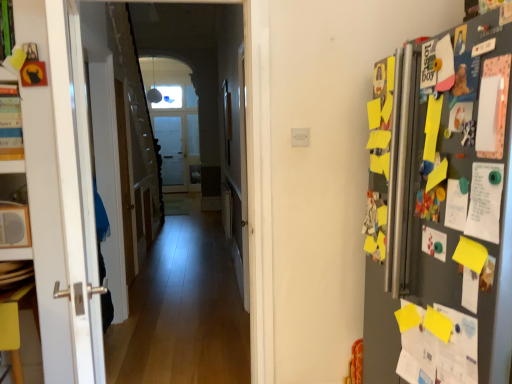
You are a GUI agent. You are given a task and a screenshot of the screen. Output one action in this format:
    pyautogui.click(x=<x>, y=<y>)
    Task: Click on the matte white lampshade at upper center
    
    Given the screenshot: What is the action you would take?
    pyautogui.click(x=154, y=90)

Locate an element on the screen. yellow paper at lower right is located at coordinates (437, 345).

Describe the element at coordinates (243, 178) in the screenshot. I see `wooden door at center, which is the 2th door in left-to-right order` at that location.

What is the approximate width of wooden door at center, arranged as the 1th door when viewed from the front?

The width of wooden door at center, arranged as the 1th door when viewed from the front, is 6.62 centimeters.

The width and height of the screenshot is (512, 384). In order to click on wooden floor at center in this screenshot , I will do `click(139, 110)`.

What do you see at coordinates (125, 182) in the screenshot?
I see `wooden door at center, the first door when ordered from back to front` at bounding box center [125, 182].

Find the location of a particular element. The image size is (512, 384). matte white lampshade at upper center is located at coordinates (154, 90).

Considering the relative positions of wooden door at center, the first door when ordered from back to front, and wooden floor at center in the image provided, is wooden door at center, the first door when ordered from back to front, to the left or to the right of wooden floor at center?

In the image, wooden door at center, the first door when ordered from back to front, appears on the left side of wooden floor at center.

Is wooden floor at center completely or partially inside wooden door at center, acting as the 1th door starting from the left?

Actually, wooden floor at center is outside wooden door at center, acting as the 1th door starting from the left.

Which of these two, wooden door at center, acting as the 1th door starting from the left, or wooden floor at center, is bigger?

Bigger between the two is wooden door at center, acting as the 1th door starting from the left.

From a real-world perspective, is wooden door at center, the first door when ordered from back to front, physically located above or below wooden floor at center?

Clearly, from a real-world perspective, wooden door at center, the first door when ordered from back to front, is below wooden floor at center.

What are the coordinates of `table on the left of wooden door at center, the 1th door in the right-to-left sequence` in the screenshot? It's located at (16, 323).

Is wooden door at center, which is the 2th door in left-to-right order, taller than yellow matte table at lower left?

Indeed, wooden door at center, which is the 2th door in left-to-right order, has a greater height compared to yellow matte table at lower left.

Between point (245, 287) and point (12, 349), which one is positioned in front?

The point (12, 349) is closer.

Could you tell me if wooden door at center, the second door when ordered from back to front, is turned towards yellow matte table at lower left?

No, wooden door at center, the second door when ordered from back to front, is not facing towards yellow matte table at lower left.

Which object is closer to the camera taking this photo, white matte speaker at left or matte white lampshade at upper center?

white matte speaker at left is in front.

Looking at this image, is white matte speaker at left positioned far away from matte white lampshade at upper center?

Yes, white matte speaker at left is far from matte white lampshade at upper center.

Which is more to the right, white matte speaker at left or matte white lampshade at upper center?

Positioned to the right is white matte speaker at left.

Locate an element on the screen. The height and width of the screenshot is (384, 512). lamp positioned vertically above the white matte speaker at left (from a real-world perspective) is located at coordinates point(154,90).

From the image's perspective, is yellow matte table at lower left located beneath wooden door at center, acting as the 1th door starting from the left?

Yes, from the image's perspective, yellow matte table at lower left is beneath wooden door at center, acting as the 1th door starting from the left.

Based on their sizes in the image, would you say yellow matte table at lower left is bigger or smaller than wooden door at center, the first door when ordered from back to front?

Considering their sizes, yellow matte table at lower left takes up less space than wooden door at center, the first door when ordered from back to front.

Where is `table in front of the wooden door at center, which ranks as the second door in right-to-left order`? The height and width of the screenshot is (384, 512). table in front of the wooden door at center, which ranks as the second door in right-to-left order is located at coordinates (16, 323).

Is wooden door at center, arranged as the 1th door when viewed from the front, wider than wooden floor at center?

Yes, wooden door at center, arranged as the 1th door when viewed from the front, is wider than wooden floor at center.

What's the angular difference between wooden door at center, arranged as the 1th door when viewed from the front, and wooden floor at center's facing directions?

wooden door at center, arranged as the 1th door when viewed from the front, and wooden floor at center are facing 89.3 degrees away from each other.

Are wooden door at center, the second door when ordered from back to front, and wooden floor at center making contact?

No.

Between wooden door at center, the second door when ordered from back to front, and wooden floor at center, which one has more height?

wooden door at center, the second door when ordered from back to front.

From a real-world perspective, which object stands above the other?

white matte speaker at left, from a real-world perspective.

From the image's perspective, who appears lower, white matte speaker at left or yellow matte table at lower left?

yellow matte table at lower left.

Would you consider white matte speaker at left to be distant from yellow matte table at lower left?

Actually, white matte speaker at left and yellow matte table at lower left are a little close together.

Who is smaller, yellow paper at lower right or yellow matte table at lower left?

Smaller between the two is yellow paper at lower right.

Considering the relative positions of yellow paper at lower right and yellow matte table at lower left in the image provided, is yellow paper at lower right to the left or to the right of yellow matte table at lower left?

yellow paper at lower right is positioned on yellow matte table at lower left's right side.

From a real-world perspective, who is located higher, yellow paper at lower right or yellow matte table at lower left?

yellow paper at lower right, from a real-world perspective.

In the scene shown: Are yellow paper at lower right and yellow matte table at lower left far apart?

Indeed, yellow paper at lower right is not near yellow matte table at lower left.

Identify the location of door on the left of wooden floor at center. (125, 182).

At what (x,y) coordinates should I click in order to perform the action: click on door that is the 2nd one when counting rightward from the yellow matte table at lower left. Please return your answer as a coordinate pair (x, y). Looking at the image, I should click on pyautogui.click(x=243, y=178).

Based on their spatial positions, is white matte speaker at left or yellow paper at lower right further from wooden door at center, the second door in the front-to-back sequence?

Among the two, yellow paper at lower right is located further to wooden door at center, the second door in the front-to-back sequence.

Looking at the image, which one is located further to white matte speaker at left, wooden door at center, arranged as the 1th door when viewed from the front, or wooden door at center, acting as the 1th door starting from the left?

wooden door at center, acting as the 1th door starting from the left, is further to white matte speaker at left.

Based on their spatial positions, is wooden floor at center or white matte speaker at left further from wooden door at center, the first door when ordered from back to front?

The object further to wooden door at center, the first door when ordered from back to front, is white matte speaker at left.

Which object lies further to the anchor point yellow matte table at lower left, matte white lampshade at upper center or wooden door at center, which ranks as the second door in right-to-left order?

matte white lampshade at upper center is positioned further to the anchor yellow matte table at lower left.

In the scene shown: Considering their positions, is matte white lampshade at upper center positioned further to yellow paper at lower right than white matte speaker at left?

matte white lampshade at upper center lies further to yellow paper at lower right than the other object.

Looking at the image, which one is located closer to matte white lampshade at upper center, yellow matte table at lower left or wooden floor at center?

wooden floor at center.

From the picture: From the image, which object appears to be nearer to yellow matte table at lower left, wooden door at center, the first door when ordered from back to front, or wooden door at center, the 1th door in the right-to-left sequence?

Based on the image, wooden door at center, the first door when ordered from back to front, appears to be nearer to yellow matte table at lower left.

From the image, which object appears to be nearer to yellow matte table at lower left, wooden door at center, the second door in the front-to-back sequence, or yellow paper at lower right?

wooden door at center, the second door in the front-to-back sequence.

Where is `table located between yellow paper at lower right and wooden door at center, acting as the 1th door starting from the left, in the depth direction`? The width and height of the screenshot is (512, 384). table located between yellow paper at lower right and wooden door at center, acting as the 1th door starting from the left, in the depth direction is located at coordinates (16, 323).

Where is `corridor between yellow paper at lower right and wooden door at center, which is the 2th door in left-to-right order, from front to back`? This screenshot has height=384, width=512. corridor between yellow paper at lower right and wooden door at center, which is the 2th door in left-to-right order, from front to back is located at coordinates (139, 110).

At what (x,y) coordinates should I click in order to perform the action: click on appliance located between yellow matte table at lower left and wooden floor at center in the left-right direction. Please return your answer as a coordinate pair (x, y). Looking at the image, I should click on (14, 225).

Locate an element on the screen. Image resolution: width=512 pixels, height=384 pixels. appliance situated between yellow matte table at lower left and yellow paper at lower right from left to right is located at coordinates (14, 225).